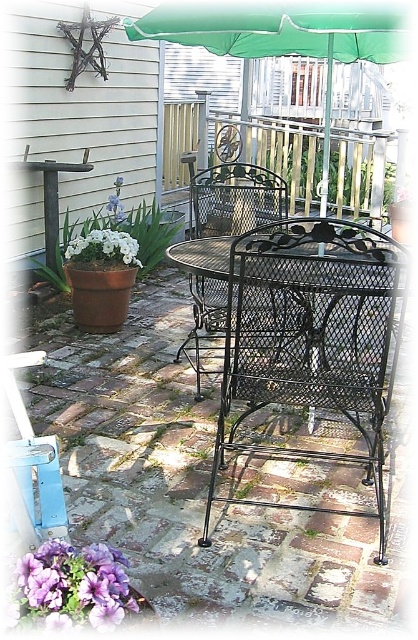
Question: Does black wrought iron chair at center have a lesser width compared to purple petal at lower left?

Choices:
 (A) yes
 (B) no

Answer: (B)

Question: Is the position of white ceramic pot at left less distant than that of white matte flower pot at lower left?

Choices:
 (A) yes
 (B) no

Answer: (B)

Question: Which object is farther from the camera taking this photo?

Choices:
 (A) green fabric umbrella at upper center
 (B) black metal chair at center

Answer: (B)

Question: Which is farther from the black wrought iron chair at center?

Choices:
 (A) black metal chair at center
 (B) white ceramic pot at left
 (C) purple petal at lower left
 (D) white matte flower pot at lower left

Answer: (B)

Question: Is black metal chair at center thinner than purple petal at lower left?

Choices:
 (A) no
 (B) yes

Answer: (A)

Question: Estimate the real-world distances between objects in this image. Which object is closer to the black wrought iron chair at center?

Choices:
 (A) white matte flower pot at lower left
 (B) green fabric umbrella at upper center
 (C) black metal chair at center

Answer: (C)